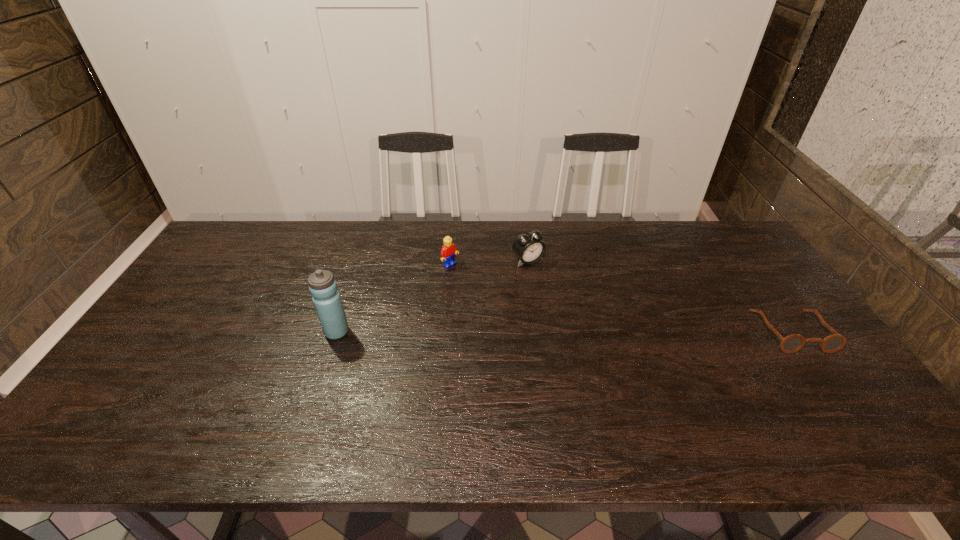
Locate an element on the screen. free location located on the front-facing side of the Lego is located at coordinates (482, 290).

Identify the location of vacant space located 0.090m on the front side of the second object from right to left. (553, 285).

Find the location of `free spot located on the front side of the second object from right to left`. free spot located on the front side of the second object from right to left is located at coordinates (586, 317).

This screenshot has width=960, height=540. In order to click on vacant space situated 0.260m on the front side of the second object from right to left in this screenshot , I will do `click(588, 319)`.

Identify the location of Lego that is at the far edge. Image resolution: width=960 pixels, height=540 pixels. (448, 251).

This screenshot has width=960, height=540. What are the coordinates of `alarm clock that is at the far edge` in the screenshot? It's located at pyautogui.click(x=528, y=247).

Identify the location of object that is at the right edge. The width and height of the screenshot is (960, 540). (792, 343).

Locate an element on the screen. This screenshot has height=540, width=960. vacant region at the far edge of the desktop is located at coordinates (511, 230).

The height and width of the screenshot is (540, 960). What are the coordinates of `free space at the near edge` in the screenshot? It's located at (221, 385).

Where is `vacant space at the left edge of the desktop`? The height and width of the screenshot is (540, 960). vacant space at the left edge of the desktop is located at coordinates (240, 282).